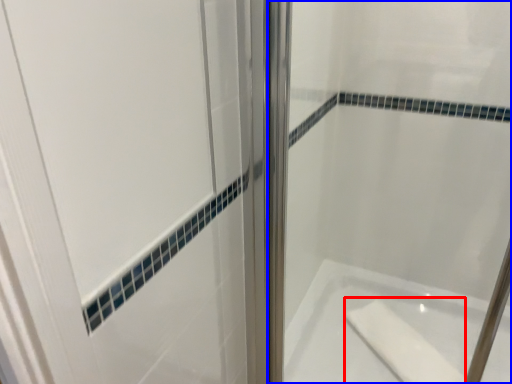
Question: Which of the following is the closest to the observer, soap (highlighted by a red box) or shower door (highlighted by a blue box)?

Choices:
 (A) soap
 (B) shower door

Answer: (B)